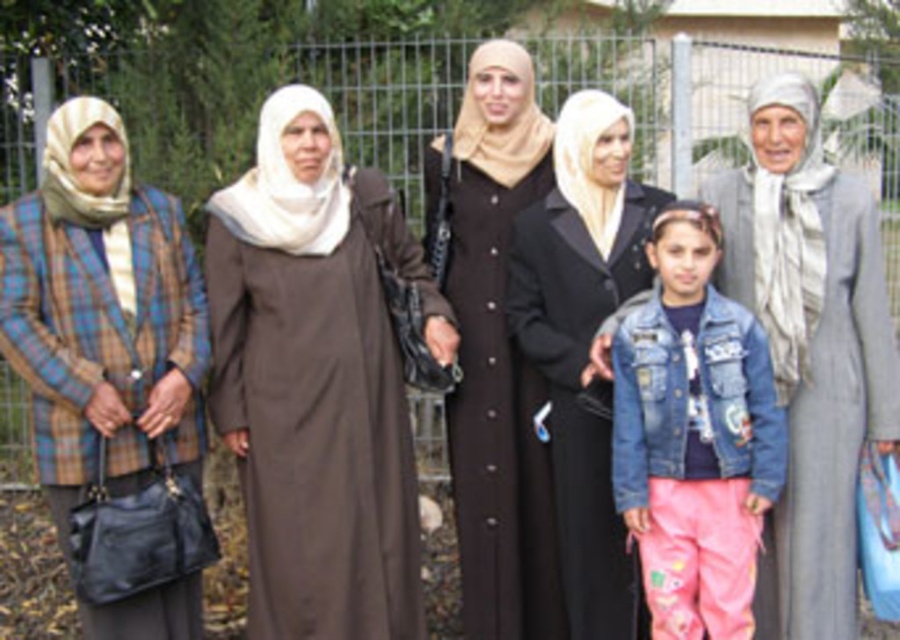
In the scene shown: Is brown matte dress at center above black satin dress at center?

No.

Between brown matte dress at center and black satin dress at center, which one is positioned lower?

brown matte dress at center is lower down.

This screenshot has height=640, width=900. I want to click on brown matte dress at center, so click(317, 380).

Who is positioned more to the left, brown matte dress at center or gray woolen dress at right?

brown matte dress at center is more to the left.

Is brown matte dress at center to the left of gray woolen dress at right from the viewer's perspective?

Correct, you'll find brown matte dress at center to the left of gray woolen dress at right.

Image resolution: width=900 pixels, height=640 pixels. In order to click on brown matte dress at center in this screenshot , I will do `click(317, 380)`.

Can you confirm if denim jacket at lower right is positioned below black satin dress at center?

Yes.

Can you confirm if denim jacket at lower right is positioned above black satin dress at center?

Actually, denim jacket at lower right is below black satin dress at center.

Is point (780, 477) closer to camera compared to point (603, 524)?

That is True.

Locate an element on the screen. denim jacket at lower right is located at coordinates (694, 435).